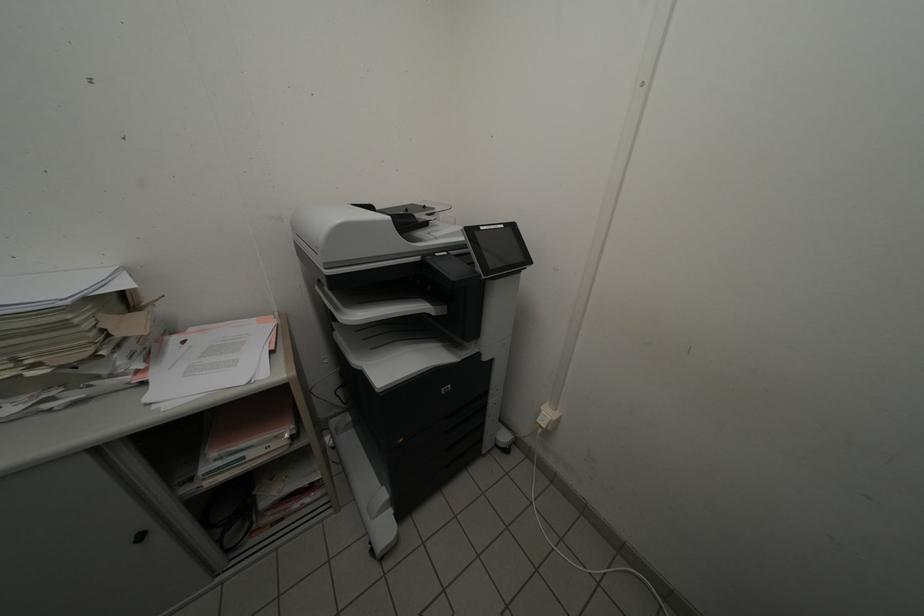
Describe the element at coordinates (400, 365) in the screenshot. I see `the printer paper tray` at that location.